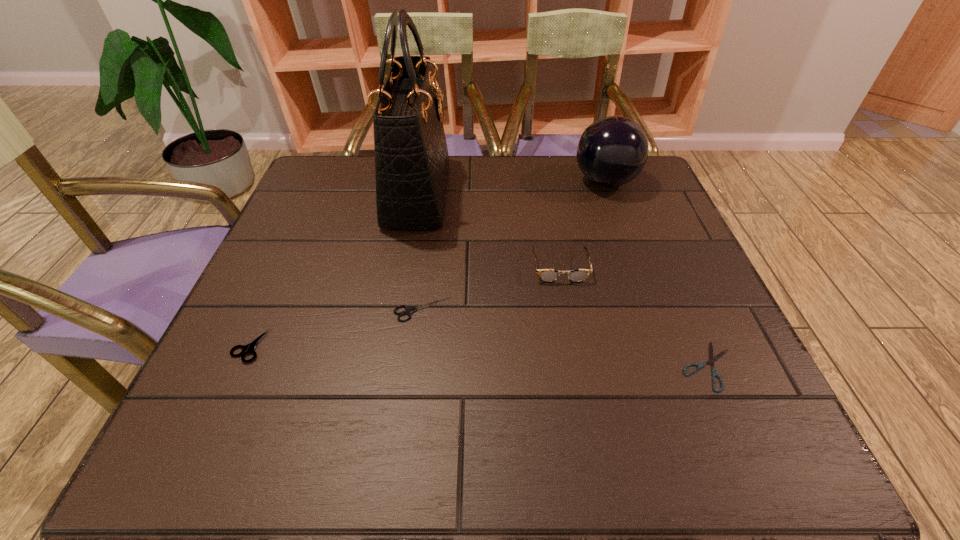
Locate an element on the screen. The width and height of the screenshot is (960, 540). free space that satisfies the following two spatial constraints: 1. at the front of the handbag with visible charms; 2. on the left side of the farthest shears is located at coordinates click(397, 309).

This screenshot has width=960, height=540. I want to click on vacant area in the image that satisfies the following two spatial constraints: 1. on the back side of the shortest object; 2. on the side of the fifth shortest object with the finger holes, so click(x=629, y=182).